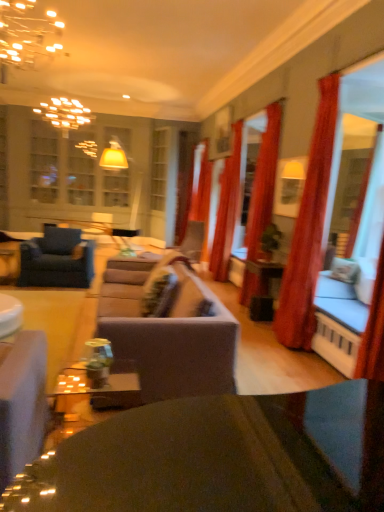
The height and width of the screenshot is (512, 384). Describe the element at coordinates (196, 192) in the screenshot. I see `matte orange curtain at center, placed as the 1th curtain when sorted from back to front` at that location.

The height and width of the screenshot is (512, 384). I want to click on suede-like gray couch at center, so click(176, 342).

In the scene shown: In order to face suede-like gray couch at center, should I rotate leftwards or rightwards?

You should look left and rotate roughly 5.438 degrees.

The image size is (384, 512). What do you see at coordinates (227, 209) in the screenshot?
I see `velvet red curtain at center, positioned as the 3th curtain in front-to-back order` at bounding box center [227, 209].

Where is `white glossy bowl at lower left, the first table from the back`? The image size is (384, 512). white glossy bowl at lower left, the first table from the back is located at coordinates (10, 315).

The height and width of the screenshot is (512, 384). I want to click on velvet red curtain at right, the fourth curtain in the back-to-front sequence, so click(x=309, y=228).

The image size is (384, 512). What do you see at coordinates (353, 333) in the screenshot? I see `velvet grey couch at right` at bounding box center [353, 333].

Where is `matte orange curtain at center, acting as the 4th curtain starting from the front`? matte orange curtain at center, acting as the 4th curtain starting from the front is located at coordinates (196, 192).

Is matte orange curtain at center, acting as the 4th curtain starting from the front, spatially inside velvet red curtain at center, positioned as the 3th curtain in front-to-back order, or outside of it?

matte orange curtain at center, acting as the 4th curtain starting from the front, cannot be found inside velvet red curtain at center, positioned as the 3th curtain in front-to-back order.

From the image's perspective, which is below, matte orange curtain at center, placed as the 1th curtain when sorted from back to front, or velvet red curtain at center, the 2th curtain in the back-to-front sequence?

velvet red curtain at center, the 2th curtain in the back-to-front sequence.

You are a GUI agent. You are given a task and a screenshot of the screen. Output one action in this format:
    pyautogui.click(x=<x>, y=<y>)
    Task: Click on the 1st curtain in front of the matte orange curtain at center, placed as the 1th curtain when sorted from back to front, starting your count from the anchor
    The image size is (384, 512).
    Given the screenshot: What is the action you would take?
    pyautogui.click(x=227, y=209)

From their relative heights in the image, would you say shiny black table at center, marked as the first table in a right-to-left arrangement, is taller or shorter than velvet grey couch at right?

shiny black table at center, marked as the first table in a right-to-left arrangement, is taller than velvet grey couch at right.

From the picture: Does shiny black table at center, marked as the first table in a right-to-left arrangement, have a larger size compared to velvet grey couch at right?

Correct, shiny black table at center, marked as the first table in a right-to-left arrangement, is larger in size than velvet grey couch at right.

From a real-world perspective, which is physically above, shiny black table at center, which is the 1th table in front-to-back order, or velvet grey couch at right?

shiny black table at center, which is the 1th table in front-to-back order, is physically above.

Visually, is shiny black table at center, placed as the 2th table when sorted from left to right, positioned to the left or to the right of velvet grey couch at right?

→ Clearly, shiny black table at center, placed as the 2th table when sorted from left to right, is on the left of velvet grey couch at right in the image.

Considering the points (2, 318) and (217, 217), which point is behind, point (2, 318) or point (217, 217)?

Positioned behind is point (217, 217).

There is a velvet red curtain at center, positioned as the 3th curtain in front-to-back order. Where is `the 2nd table below it (from a real-world perspective)`? The image size is (384, 512). the 2nd table below it (from a real-world perspective) is located at coordinates (10, 315).

Is white glossy bowl at lower left, which is the 1th table from left to right, looking in the opposite direction of velvet red curtain at center, positioned as the 3th curtain in front-to-back order?

No, velvet red curtain at center, positioned as the 3th curtain in front-to-back order, is not at the back of white glossy bowl at lower left, which is the 1th table from left to right.

Does white glossy bowl at lower left, the first table from the back, lie in front of velvet red curtain at center, positioned as the 3th curtain in front-to-back order?

Yes.

Is velvet grey couch at right positioned far away from velvet red curtain at center, positioned as the 3th curtain in front-to-back order?

Indeed, velvet grey couch at right is not near velvet red curtain at center, positioned as the 3th curtain in front-to-back order.

Relative to velvet red curtain at center, positioned as the 3th curtain in front-to-back order, is velvet grey couch at right in front or behind?

Clearly, velvet grey couch at right is in front of velvet red curtain at center, positioned as the 3th curtain in front-to-back order.

Is velvet grey couch at right oriented towards velvet red curtain at center, the 2th curtain in the back-to-front sequence?

No, velvet grey couch at right does not turn towards velvet red curtain at center, the 2th curtain in the back-to-front sequence.

Considering the positions of points (310, 152) and (204, 182), is point (310, 152) farther from camera compared to point (204, 182)?

That is False.

Which is more to the left, velvet red curtain at right, the 1th curtain when ordered from front to back, or matte orange curtain at center, acting as the 4th curtain starting from the front?

matte orange curtain at center, acting as the 4th curtain starting from the front, is more to the left.

How many degrees apart are the facing directions of velvet red curtain at right, the fourth curtain in the back-to-front sequence, and matte orange curtain at center, placed as the 1th curtain when sorted from back to front?

They differ by 1.88 degrees in their facing directions.

At what (x,y) coordinates should I click in order to perform the action: click on the 3rd curtain counting from the right side of the matte orange curtain at center, acting as the 4th curtain starting from the front. Please return your answer as a coordinate pair (x, y). Looking at the image, I should click on (309, 228).

Consider the image. Does velvet red curtain at center, positioned as the 3th curtain in front-to-back order, have a larger size compared to gold metallic chandelier at upper left?

Yes.

Is velvet red curtain at center, positioned as the 3th curtain in front-to-back order, taller or shorter than gold metallic chandelier at upper left?

velvet red curtain at center, positioned as the 3th curtain in front-to-back order, is taller than gold metallic chandelier at upper left.

From a real-world perspective, between velvet red curtain at center, positioned as the 3th curtain in front-to-back order, and gold metallic chandelier at upper left, who is vertically higher?

From a 3D spatial view, gold metallic chandelier at upper left is above.

How different are the orientations of velvet red curtain at right, the 1th curtain when ordered from front to back, and velvet red curtain at center, positioned as the 3th curtain in front-to-back order, in degrees?

There is a 0.473-degree angle between the facing directions of velvet red curtain at right, the 1th curtain when ordered from front to back, and velvet red curtain at center, positioned as the 3th curtain in front-to-back order.

Which object is positioned more to the left, velvet red curtain at right, the fourth curtain in the back-to-front sequence, or velvet red curtain at center, the 2th curtain in the back-to-front sequence?

velvet red curtain at center, the 2th curtain in the back-to-front sequence.

Could velvet red curtain at center, the 2th curtain in the back-to-front sequence, be considered to be inside velvet red curtain at right, the fourth curtain in the back-to-front sequence?

No, velvet red curtain at center, the 2th curtain in the back-to-front sequence, is not surrounded by velvet red curtain at right, the fourth curtain in the back-to-front sequence.

Is velvet red curtain at right, the fourth curtain in the back-to-front sequence, positioned with its back to velvet red curtain at center, positioned as the 3th curtain in front-to-back order?

No, velvet red curtain at right, the fourth curtain in the back-to-front sequence, is not facing away from velvet red curtain at center, positioned as the 3th curtain in front-to-back order.

What are the coordinates of `the 1st curtain in front of the matte orange curtain at center, acting as the 4th curtain starting from the front` in the screenshot? It's located at (227, 209).

There is a velvet grey couch at right. Where is `table above it (from a real-world perspective)`? This screenshot has width=384, height=512. table above it (from a real-world perspective) is located at coordinates (208, 457).

Which object lies further to the anchor point shiny black table at center, marked as the second table in a back-to-front arrangement, velvet red curtain at right, the fourth curtain in the back-to-front sequence, or velvet blue armchair at left?

Based on the image, velvet blue armchair at left appears to be further to shiny black table at center, marked as the second table in a back-to-front arrangement.

Looking at the image, which one is located closer to velvet red curtain at right, the 1th curtain when ordered from front to back, white glossy bowl at lower left, which is the 1th table from left to right, or red velvet curtain at right, which ranks as the 3th curtain in back-to-front order?

Among the two, red velvet curtain at right, which ranks as the 3th curtain in back-to-front order, is located nearer to velvet red curtain at right, the 1th curtain when ordered from front to back.

In the scene shown: Considering their positions, is suede-like gray couch at center positioned closer to velvet grey couch at right than velvet red curtain at right, the fourth curtain in the back-to-front sequence?

The object closer to velvet grey couch at right is velvet red curtain at right, the fourth curtain in the back-to-front sequence.

From the image, which object appears to be farther from velvet blue armchair at left, velvet grey couch at right or suede-like gray couch at center?

The object further to velvet blue armchair at left is velvet grey couch at right.

From the image, which object appears to be nearer to velvet blue armchair at left, white glossy bowl at lower left, the first table from the back, or matte orange curtain at center, acting as the 4th curtain starting from the front?

white glossy bowl at lower left, the first table from the back, lies closer to velvet blue armchair at left than the other object.

Based on their spatial positions, is matte orange curtain at center, placed as the 1th curtain when sorted from back to front, or suede-like gray couch at center further from gold metallic chandelier at upper left?

suede-like gray couch at center is positioned further to the anchor gold metallic chandelier at upper left.

From the image, which object appears to be farther from red velvet curtain at right, acting as the 2th curtain starting from the front, velvet blue armchair at left or gold metallic chandelier at upper left?

gold metallic chandelier at upper left is positioned further to the anchor red velvet curtain at right, acting as the 2th curtain starting from the front.

Which object lies further to the anchor point suede-like gray couch at center, velvet grey couch at right or velvet red curtain at center, positioned as the 3th curtain in front-to-back order?

velvet red curtain at center, positioned as the 3th curtain in front-to-back order, is positioned further to the anchor suede-like gray couch at center.

The width and height of the screenshot is (384, 512). What are the coordinates of `table located between gold metallic chandelier at upper left and velvet blue armchair at left in the depth direction` in the screenshot? It's located at (10, 315).

This screenshot has width=384, height=512. In order to click on studio couch between shiny black table at center, marked as the first table in a right-to-left arrangement, and velvet blue armchair at left in the front-back direction in this screenshot , I will do click(x=176, y=342).

At what (x,y) coordinates should I click in order to perform the action: click on table between shiny black table at center, marked as the second table in a back-to-front arrangement, and velvet red curtain at center, positioned as the 3th curtain in front-to-back order, in the front-back direction. Please return your answer as a coordinate pair (x, y). Looking at the image, I should click on (10, 315).

I want to click on curtain positioned between shiny black table at center, marked as the second table in a back-to-front arrangement, and white glossy bowl at lower left, which is the 1th table from left to right, from near to far, so click(309, 228).